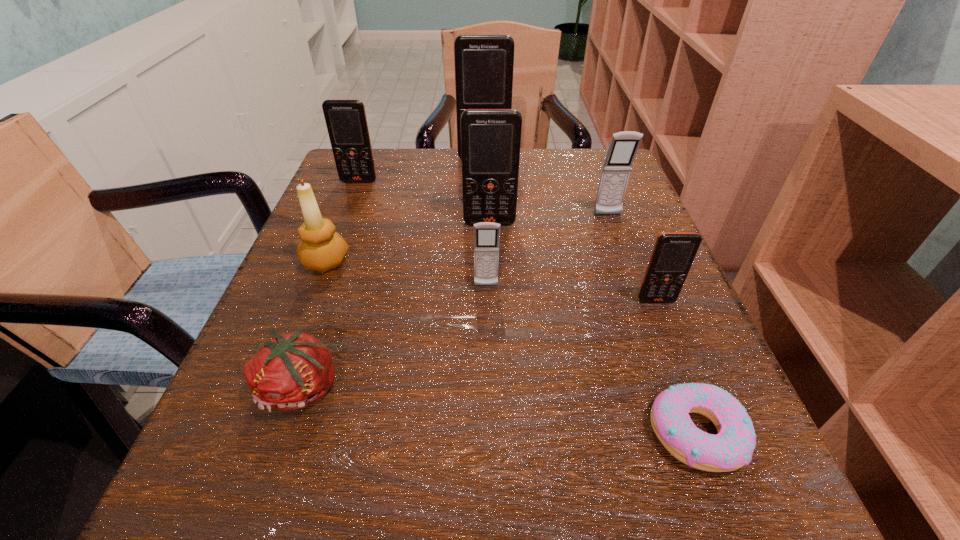
Locate an element on the screen. This screenshot has width=960, height=540. the biggest orange cellular telephone is located at coordinates (484, 64).

Find the location of a particular element. The width and height of the screenshot is (960, 540). the tallest cellular telephone is located at coordinates (484, 64).

Where is `the fifth shortest cellular telephone`? the fifth shortest cellular telephone is located at coordinates (490, 138).

Identify the location of the third nearest cellular telephone. The width and height of the screenshot is (960, 540). (490, 138).

This screenshot has width=960, height=540. I want to click on the seventh nearest object, so point(623,147).

Find the location of a particular element. the farther gray cellular telephone is located at coordinates (623, 147).

Locate an element on the screen. the leftmost orange cellular telephone is located at coordinates (346, 121).

You are a GUI agent. You are given a task and a screenshot of the screen. Output one action in this format:
    pyautogui.click(x=<x>, y=<y>)
    Task: Click on the second farthest cellular telephone
    The width and height of the screenshot is (960, 540).
    Given the screenshot: What is the action you would take?
    pyautogui.click(x=346, y=121)

The image size is (960, 540). I want to click on candle_holder, so click(x=322, y=248).

I want to click on the smallest orange cellular telephone, so click(673, 254).